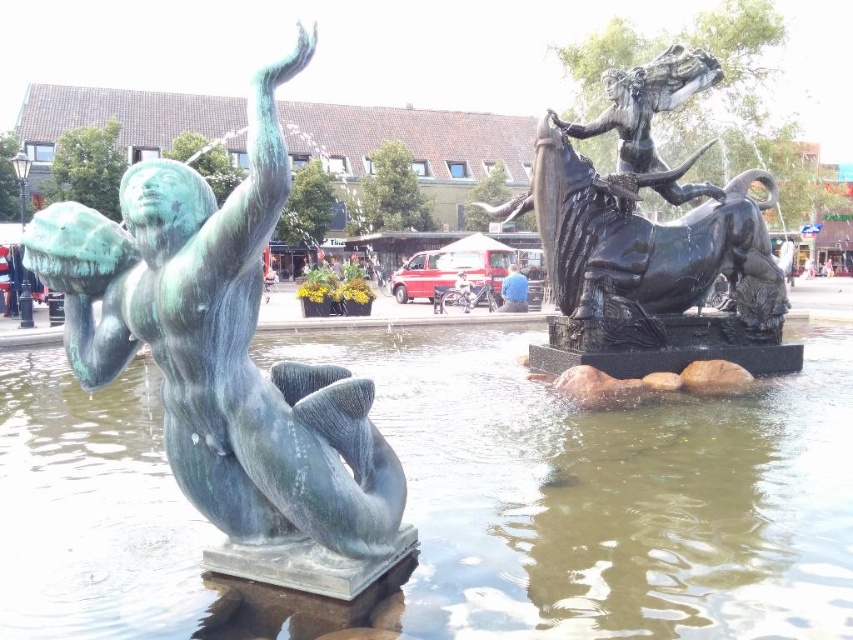
Which is in front, point (589, 342) or point (790, 248)?

Point (589, 342)

Measure the distance from polished bronze statue at center to white fluffy cloud at upper center.

They are 9.59 meters apart.

Image resolution: width=853 pixels, height=640 pixels. Identify the location of polished bronze statue at center. (650, 241).

Is point (808, 636) positioned before point (782, 269)?

That is True.

Consider the image. Is green patina water at center closer to camera compared to white fluffy cloud at upper center?

Yes, green patina water at center is closer to the viewer.

Between point (158, 532) and point (782, 241), which one is positioned in front?

Point (158, 532)

Identify the location of green patina water at center. (456, 502).

Can you confirm if green patina water at center is positioned below green patina bronze mermaid at left?

Correct, green patina water at center is located below green patina bronze mermaid at left.

Does green patina water at center have a greater width compared to green patina bronze mermaid at left?

Correct, the width of green patina water at center exceeds that of green patina bronze mermaid at left.

Between point (459, 506) and point (178, 268), which one is positioned in front?

Point (178, 268) is in front.

Locate an element on the screen. green patina water at center is located at coordinates (456, 502).